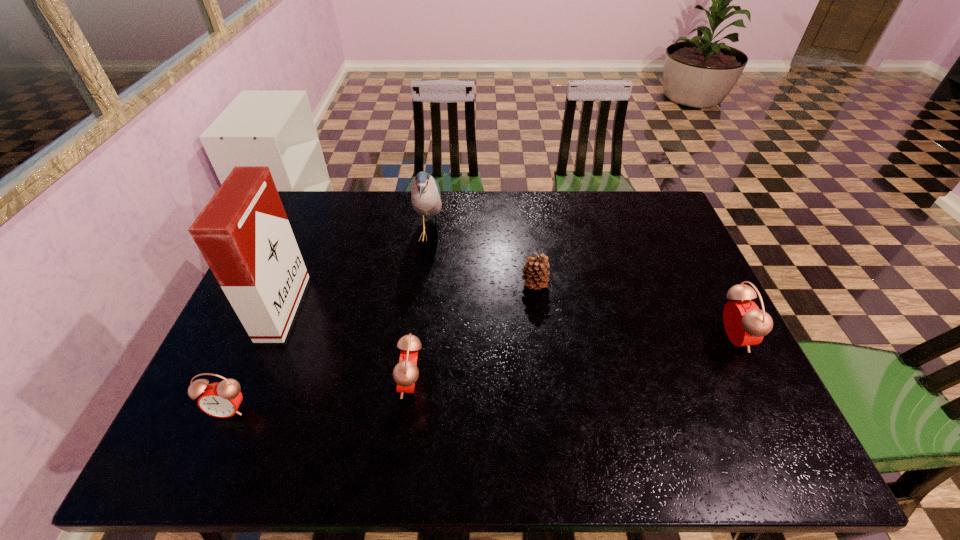
Where is `the shortest alarm clock`? The image size is (960, 540). the shortest alarm clock is located at coordinates (222, 399).

This screenshot has width=960, height=540. Identify the location of the third shortest object. (405, 373).

Find the location of `the second shortest alarm clock`. the second shortest alarm clock is located at coordinates (405, 373).

You are a GUI agent. You are given a task and a screenshot of the screen. Output one action in this format:
    pyautogui.click(x=<x>, y=<y>)
    Task: Click on the rightmost alarm clock
    
    Given the screenshot: What is the action you would take?
    pyautogui.click(x=745, y=325)

Locate an element on the screen. Image resolution: width=960 pixels, height=540 pixels. bird is located at coordinates [425, 196].

At what (x,y) coordinates should I click in order to perform the action: click on the farthest object. Please return your answer as a coordinate pair (x, y). This screenshot has width=960, height=540. Looking at the image, I should click on (425, 196).

Image resolution: width=960 pixels, height=540 pixels. I want to click on the tallest object, so click(x=243, y=233).

Find the location of a particular element. pinecone is located at coordinates (535, 271).

Find the location of a particular element. The height and width of the screenshot is (540, 960). vacant space situated on the clock face of the second alarm clock from right to left is located at coordinates (265, 383).

The width and height of the screenshot is (960, 540). I want to click on vacant space located on the clock face of the second alarm clock from right to left, so click(x=360, y=383).